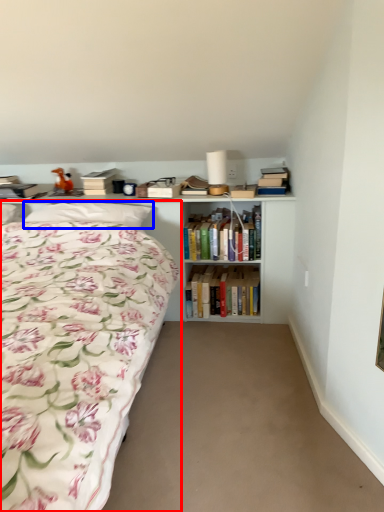
Question: Which object appears farthest to the camera in this image, bed (highlighted by a red box) or pillow (highlighted by a blue box)?

Choices:
 (A) bed
 (B) pillow

Answer: (B)